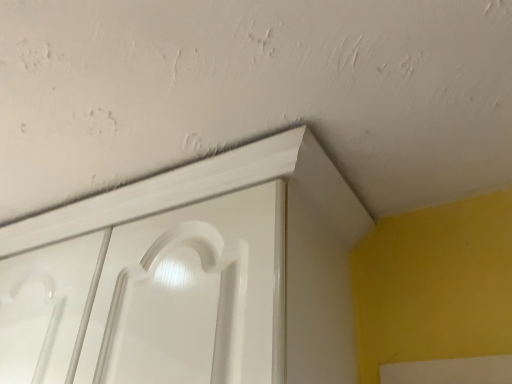
Describe the element at coordinates (209, 193) in the screenshot. I see `white glossy cupboard at center` at that location.

What is the approximate width of white glossy cupboard at center?

It is 36.07 centimeters.

The width and height of the screenshot is (512, 384). Find the location of `white glossy cupboard at center`. white glossy cupboard at center is located at coordinates (209, 193).

Image resolution: width=512 pixels, height=384 pixels. I want to click on white glossy cupboard at center, so coord(209,193).